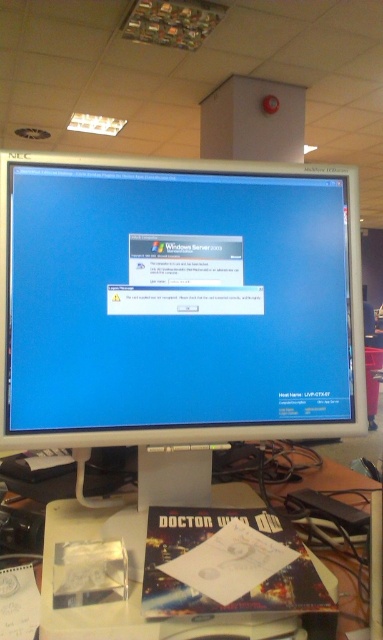
Does point (307, 282) lie behind point (332, 552)?

No, it is not.

Is point (181, 349) positioned before point (333, 454)?

Yes, point (181, 349) is in front of point (333, 454).

The width and height of the screenshot is (383, 640). I want to click on white glossy monitor at center, so click(178, 301).

What are the coordinates of `white glossy monitor at center` in the screenshot? It's located at (178, 301).